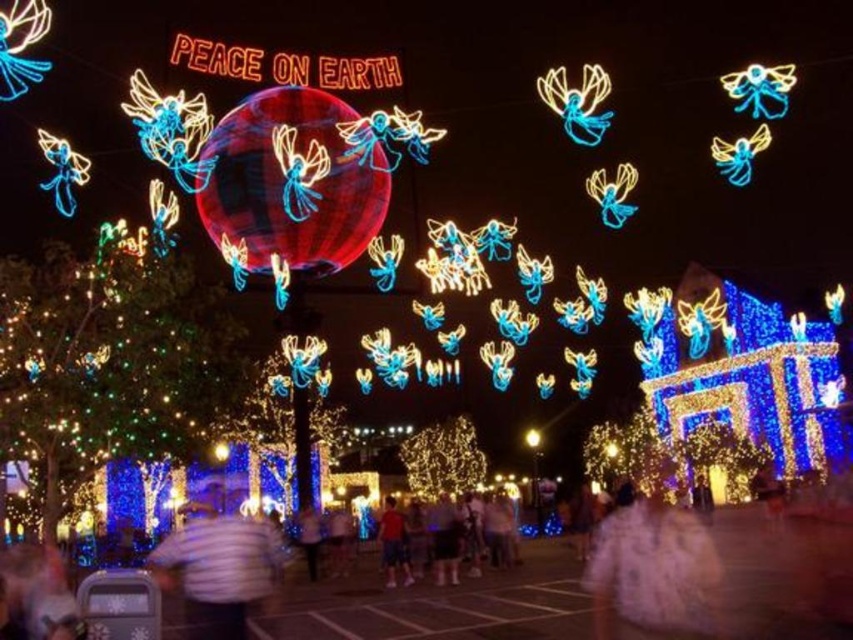
Question: In this image, where is white striped shirt at center located relative to matte red shirt at center?

Choices:
 (A) left
 (B) right

Answer: (A)

Question: Which point is closer to the camera?

Choices:
 (A) (194, 618)
 (B) (390, 531)

Answer: (A)

Question: Is white striped shirt at center thinner than matte red shirt at center?

Choices:
 (A) no
 (B) yes

Answer: (A)

Question: Which point is closer to the camera?

Choices:
 (A) (410, 573)
 (B) (215, 552)

Answer: (B)

Question: Which point is closer to the camera taking this photo?

Choices:
 (A) (238, 584)
 (B) (399, 513)

Answer: (A)

Question: Observing the image, what is the correct spatial positioning of white striped shirt at center in reference to matte red shirt at center?

Choices:
 (A) above
 (B) below

Answer: (A)